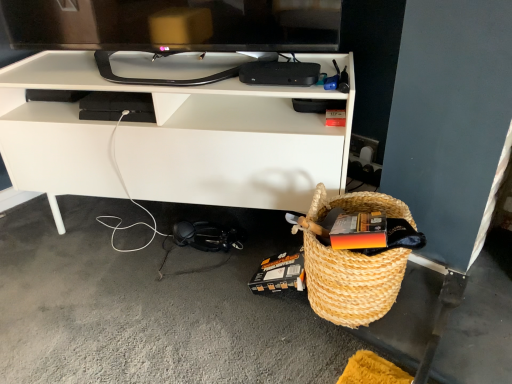
Question: Considering the relative sizes of black glossy tv at upper center and natural woven picnic basket at lower right in the image provided, is black glossy tv at upper center thinner than natural woven picnic basket at lower right?

Choices:
 (A) no
 (B) yes

Answer: (B)

Question: Can you confirm if black glossy tv at upper center is positioned to the left of natural woven picnic basket at lower right?

Choices:
 (A) no
 (B) yes

Answer: (B)

Question: Can we say black glossy tv at upper center lies outside natural woven picnic basket at lower right?

Choices:
 (A) no
 (B) yes

Answer: (B)

Question: Can you confirm if black glossy tv at upper center is smaller than natural woven picnic basket at lower right?

Choices:
 (A) yes
 (B) no

Answer: (B)

Question: Is black glossy tv at upper center shorter than natural woven picnic basket at lower right?

Choices:
 (A) no
 (B) yes

Answer: (B)

Question: Considering the positions of point (12, 129) and point (390, 278), is point (12, 129) closer or farther from the camera than point (390, 278)?

Choices:
 (A) farther
 (B) closer

Answer: (A)

Question: Looking at the image, does white matte desk at center seem bigger or smaller compared to natural woven picnic basket at lower right?

Choices:
 (A) small
 (B) big

Answer: (B)

Question: Is white matte desk at center wider or thinner than natural woven picnic basket at lower right?

Choices:
 (A) wide
 (B) thin

Answer: (A)

Question: Is white matte desk at center in front of or behind natural woven picnic basket at lower right in the image?

Choices:
 (A) front
 (B) behind

Answer: (B)

Question: From a real-world perspective, is black glossy tv at upper center positioned above or below natural woven picnic basket at lower right?

Choices:
 (A) below
 (B) above

Answer: (B)

Question: From the image's perspective, is black glossy tv at upper center above or below natural woven picnic basket at lower right?

Choices:
 (A) below
 (B) above

Answer: (B)

Question: Based on their positions, is black glossy tv at upper center located to the left or right of natural woven picnic basket at lower right?

Choices:
 (A) right
 (B) left

Answer: (B)

Question: From their relative heights in the image, would you say black glossy tv at upper center is taller or shorter than natural woven picnic basket at lower right?

Choices:
 (A) short
 (B) tall

Answer: (A)

Question: Based on their sizes in the image, would you say white matte desk at center is bigger or smaller than black glossy tv at upper center?

Choices:
 (A) small
 (B) big

Answer: (B)

Question: Is white matte desk at center wider or thinner than black glossy tv at upper center?

Choices:
 (A) thin
 (B) wide

Answer: (B)